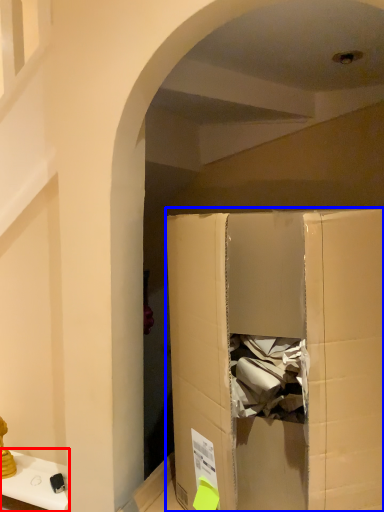
Question: Among these objects, which one is nearest to the camera, furniture (highlighted by a red box) or cardboard box (highlighted by a blue box)?

Choices:
 (A) furniture
 (B) cardboard box

Answer: (B)